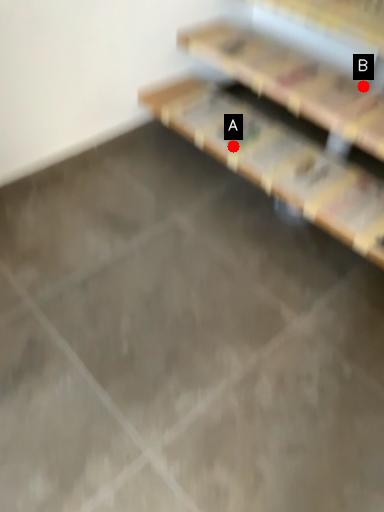
Question: Two points are circled on the image, labeled by A and B beside each circle. Which point is further to the camera?

Choices:
 (A) A is further
 (B) B is further

Answer: (B)